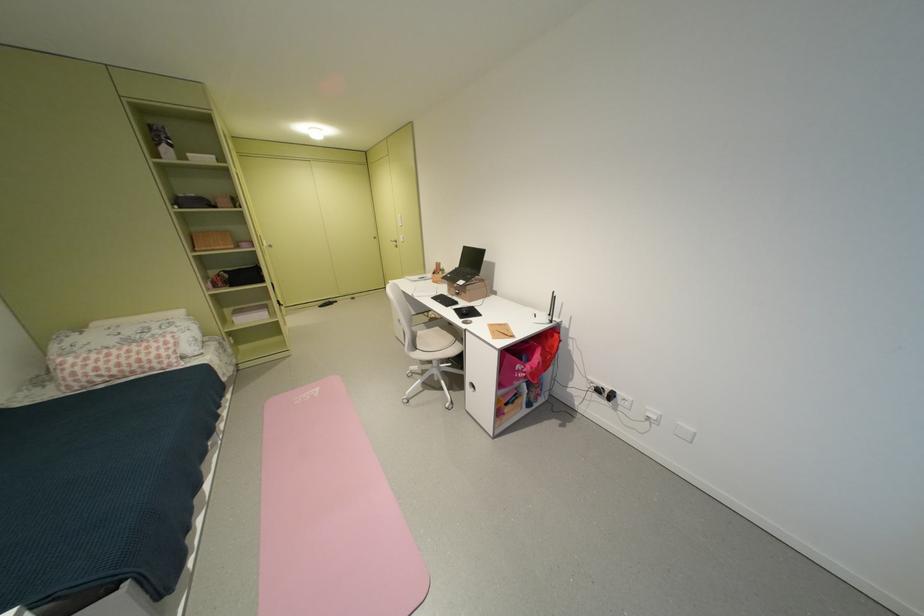
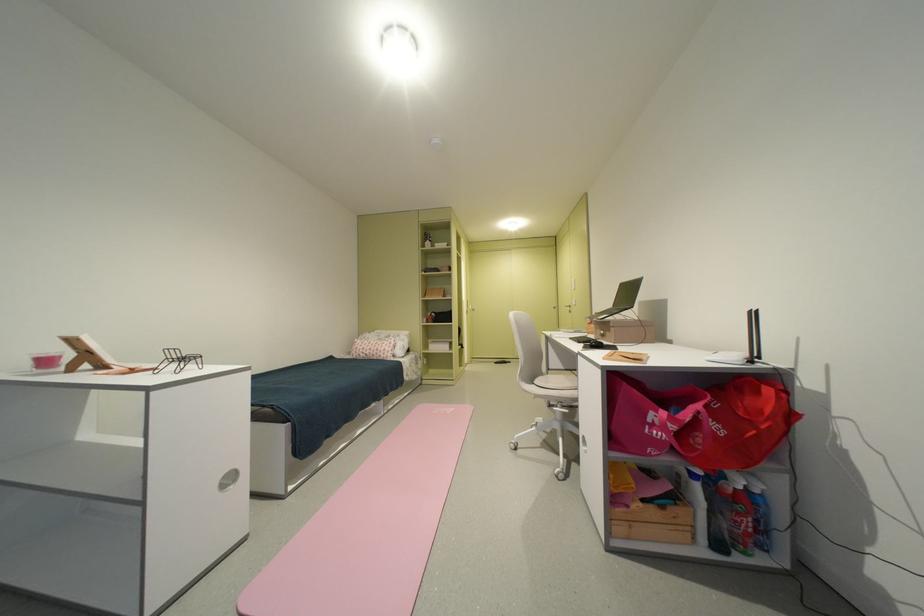
Where in the second image is the point corresponding to (x=411, y=241) from the first image?

(584, 305)